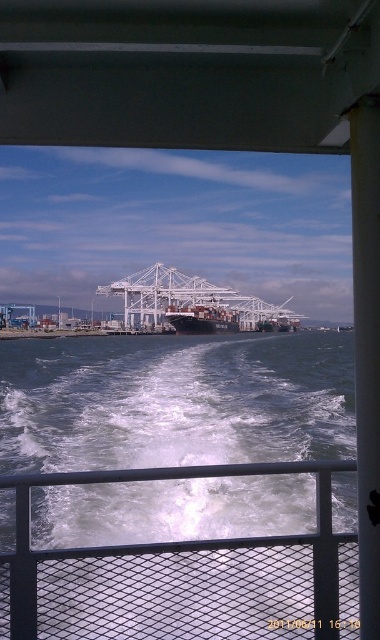
From the picture: You are standing on the deck of the vessel and see two points marked on the railing. The first point is at location point (280, 602) and the second is at point (193, 305). If you want to move from the first point to the second point along the railing, which direction should you face?

To move from point (280, 602) to point (193, 305) along the railing, you should face towards the direction where point (193, 305) is located, which is behind point (280, 602) since the first point is in front of the second one.